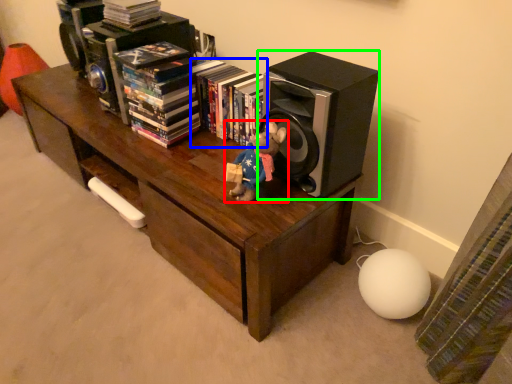
Question: Which object is positioned farthest from toy (highlighted by a red box)? Select from book (highlighted by a blue box) and speaker (highlighted by a green box).

Choices:
 (A) book
 (B) speaker

Answer: (A)